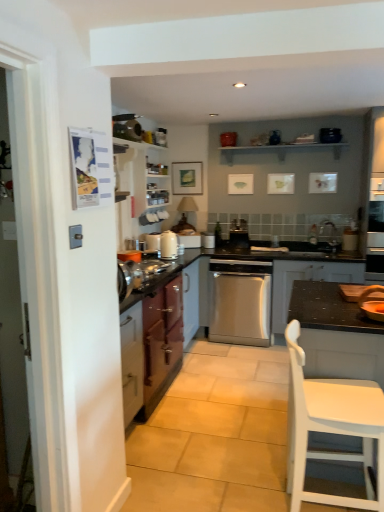
You are a GUI agent. You are given a task and a screenshot of the screen. Output one action in this format:
    pyautogui.click(x=<x>, y=<y>)
    Task: Click on the matte wooden picture frame at upper center
    The height and width of the screenshot is (512, 384).
    Given the screenshot: What is the action you would take?
    pyautogui.click(x=187, y=178)

What do you see at coordinates (156, 335) in the screenshot? This screenshot has width=384, height=512. I see `metallic purple cabinet at left, the 3th cabinetry viewed from the right` at bounding box center [156, 335].

Describe the element at coordinates (306, 279) in the screenshot. The height and width of the screenshot is (512, 384). I see `dark gray matte cabinet at center, marked as the 1th cabinetry in a right-to-left arrangement` at that location.

The image size is (384, 512). What do you see at coordinates (281, 149) in the screenshot? I see `white wooden shelf at upper center` at bounding box center [281, 149].

At what (x,y) coordinates should I click in order to perform the action: click on matte wooden picture frame at upper center. Please return your answer as a coordinate pair (x, y). Looking at the image, I should click on (187, 178).

Is point (210, 245) farther from camera compared to point (169, 259)?

Yes, it is.

From the picture: From the image's perspective, would you say satin silver dishwasher at center, acting as the first appliance starting from the back, is shown under white glossy kettle at center?

No, from the image's perspective, satin silver dishwasher at center, acting as the first appliance starting from the back, is not beneath white glossy kettle at center.

Looking at this image, which object is positioned more to the left, satin silver dishwasher at center, acting as the first appliance starting from the back, or white glossy kettle at center?

From the viewer's perspective, white glossy kettle at center appears more on the left side.

Is satin silver dishwasher at center, marked as the 3th appliance in a front-to-back arrangement, looking in the opposite direction of white glossy kettle at center?

satin silver dishwasher at center, marked as the 3th appliance in a front-to-back arrangement, is not turned away from white glossy kettle at center.

From the image's perspective, would you say wooden shelves at upper center, positioned as the 2th cabinetry in left-to-right order, is shown under matte wooden picture frame at upper center?

Yes.

Is wooden shelves at upper center, the 2th cabinetry positioned from the right, shorter than matte wooden picture frame at upper center?

No, wooden shelves at upper center, the 2th cabinetry positioned from the right, is not shorter than matte wooden picture frame at upper center.

Between wooden bowl at right, the third appliance in the left-to-right sequence, and wooden shelves at upper center, positioned as the 2th cabinetry in left-to-right order, which one appears on the right side from the viewer's perspective?

Positioned to the right is wooden bowl at right, the third appliance in the left-to-right sequence.

Can you tell me how much wooden bowl at right, the third appliance in the left-to-right sequence, and wooden shelves at upper center, positioned as the 2th cabinetry in left-to-right order, differ in facing direction?

wooden bowl at right, the third appliance in the left-to-right sequence, and wooden shelves at upper center, positioned as the 2th cabinetry in left-to-right order, are facing 89.8 degrees away from each other.

Based on the photo, considering the relative sizes of wooden bowl at right, the third appliance in the left-to-right sequence, and wooden shelves at upper center, the 2th cabinetry positioned from the right, in the image provided, is wooden bowl at right, the third appliance in the left-to-right sequence, thinner than wooden shelves at upper center, the 2th cabinetry positioned from the right,?

Incorrect, the width of wooden bowl at right, the third appliance in the left-to-right sequence, is not less than that of wooden shelves at upper center, the 2th cabinetry positioned from the right.

Is wooden bowl at right, which ranks as the 1th appliance in front-to-back order, oriented away from wooden shelves at upper center, positioned as the 2th cabinetry in left-to-right order?

That's not correct — wooden bowl at right, which ranks as the 1th appliance in front-to-back order, is not looking away from wooden shelves at upper center, positioned as the 2th cabinetry in left-to-right order.

Does satin stainless steel dishwasher at center have a greater height compared to wooden bowl at right, which appears as the first appliance when ordered from the bottom?

Yes, satin stainless steel dishwasher at center is taller than wooden bowl at right, which appears as the first appliance when ordered from the bottom.

Is satin stainless steel dishwasher at center touching wooden bowl at right, the third appliance from the back?

satin stainless steel dishwasher at center and wooden bowl at right, the third appliance from the back, are not in contact.

I want to click on home appliance beneath the wooden bowl at right, acting as the 3th appliance starting from the top (from a real-world perspective), so click(240, 301).

From a real-world perspective, is satin stainless steel dishwasher at center over wooden bowl at right, the third appliance from the back?

No, from a real-world perspective, satin stainless steel dishwasher at center is not over wooden bowl at right, the third appliance from the back

Who is taller, matte wooden picture frame at upper center or white wooden shelf at upper center?

matte wooden picture frame at upper center.

Is matte wooden picture frame at upper center placed right next to white wooden shelf at upper center?

No, matte wooden picture frame at upper center is not touching white wooden shelf at upper center.

In the scene shown: Which is closer, (198, 189) or (262, 145)?

Point (198, 189) is positioned farther from the camera compared to point (262, 145).

Is point (265, 291) positioned behind point (309, 144)?

No, (265, 291) is closer to viewer.

Does satin stainless steel dishwasher at center come behind white wooden shelf at upper center?

No.

From their relative heights in the image, would you say satin stainless steel dishwasher at center is taller or shorter than white wooden shelf at upper center?

In the image, satin stainless steel dishwasher at center appears to be taller than white wooden shelf at upper center.

Looking at their sizes, would you say satin stainless steel dishwasher at center is wider or thinner than white wooden shelf at upper center?

In the image, satin stainless steel dishwasher at center appears to be wider than white wooden shelf at upper center.

From the image's perspective, relative to white plastic chair at lower right, is wooden bowl at right, which is the 1th appliance in right-to-left order, above or below?

From the image's perspective, wooden bowl at right, which is the 1th appliance in right-to-left order, appears above white plastic chair at lower right.

You are a GUI agent. You are given a task and a screenshot of the screen. Output one action in this format:
    pyautogui.click(x=<x>, y=<y>)
    Task: Click on the 2nd appliance located above the white plastic chair at lower right (from a real-world perspective)
    
    Given the screenshot: What is the action you would take?
    pyautogui.click(x=372, y=303)

Who is taller, wooden bowl at right, which is the 1th appliance in right-to-left order, or white plastic chair at lower right?

Standing taller between the two is white plastic chair at lower right.

Based on the photo, which is farther from the camera, (379, 318) or (304, 396)?

Point (379, 318)

I want to click on kitchen appliance located below the satin silver dishwasher at center, marked as the 3th appliance in a front-to-back arrangement (from the image's perspective), so click(168, 245).

The image size is (384, 512). Identify the location of cabinetry above the matte wooden picture frame at upper center (from a real-world perspective). click(144, 175).

Looking at the image, which one is located closer to white plastic chair at lower right, white glossy kettle at center or satin silver dishwasher at center, acting as the first appliance starting from the back?

Among the two, white glossy kettle at center is located nearer to white plastic chair at lower right.

When comparing their distances from satin silver dishwasher at center, the 2th appliance when ordered from bottom to top, does white wooden shelf at upper center or wooden shelves at upper center, positioned as the 2th cabinetry in left-to-right order, seem further?

Based on the image, white wooden shelf at upper center appears to be further to satin silver dishwasher at center, the 2th appliance when ordered from bottom to top.

Considering their positions, is white wooden shelf at upper center positioned closer to matte wooden picture frame at upper center than wooden bowl at right, the third appliance in the left-to-right sequence?

The object closer to matte wooden picture frame at upper center is white wooden shelf at upper center.

Estimate the real-world distances between objects in this image. Which object is closer to white plastic chair at lower right, dark gray matte cabinet at center, the 3th cabinetry when ordered from left to right, or wooden bowl at right, the third appliance from the back?

Based on the image, wooden bowl at right, the third appliance from the back, appears to be nearer to white plastic chair at lower right.

When comparing their distances from white wooden shelf at upper center, does metallic purple cabinet at left, the 3th cabinetry viewed from the right, or satin stainless steel dishwasher at center seem further?

The object further to white wooden shelf at upper center is metallic purple cabinet at left, the 3th cabinetry viewed from the right.

Based on their spatial positions, is matte wooden picture frame at upper center or satin silver dishwasher at center, placed as the second appliance when sorted from top to bottom, further from white plastic chair at lower right?

The object further to white plastic chair at lower right is matte wooden picture frame at upper center.

Estimate the real-world distances between objects in this image. Which object is further from dark gray matte cabinet at center, marked as the 1th cabinetry in a right-to-left arrangement, metallic purple cabinet at left, the 3th cabinetry viewed from the right, or wooden shelves at upper center, the 2th cabinetry positioned from the right?

wooden shelves at upper center, the 2th cabinetry positioned from the right.

Considering their positions, is white plastic chair at lower right positioned further to white glossy kettle at center than satin silver coffee machine at center, which is the second appliance in left-to-right order?

Among the two, white plastic chair at lower right is located further to white glossy kettle at center.

Where is `kitchen appliance between wooden shelves at upper center, the 2th cabinetry positioned from the right, and white wooden shelf at upper center from left to right`? The width and height of the screenshot is (384, 512). kitchen appliance between wooden shelves at upper center, the 2th cabinetry positioned from the right, and white wooden shelf at upper center from left to right is located at coordinates (168, 245).

The height and width of the screenshot is (512, 384). Find the location of `picture frame between wooden shelves at upper center, the 2th cabinetry positioned from the right, and satin silver coffee machine at center, which is the second appliance in left-to-right order`. picture frame between wooden shelves at upper center, the 2th cabinetry positioned from the right, and satin silver coffee machine at center, which is the second appliance in left-to-right order is located at coordinates (187, 178).

Find the location of a particular element. kitchen appliance between metallic purple cabinet at left, the 3th cabinetry viewed from the right, and satin stainless steel dishwasher at center, along the z-axis is located at coordinates (168, 245).

Where is `home appliance between satin silver dishwasher at center, placed as the second appliance when sorted from top to bottom, and dark gray matte cabinet at center, marked as the 1th cabinetry in a right-to-left arrangement`? The width and height of the screenshot is (384, 512). home appliance between satin silver dishwasher at center, placed as the second appliance when sorted from top to bottom, and dark gray matte cabinet at center, marked as the 1th cabinetry in a right-to-left arrangement is located at coordinates (240, 301).